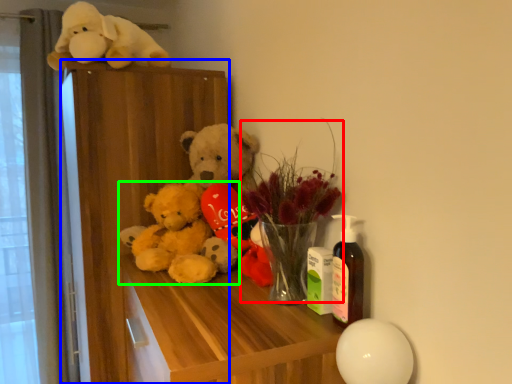
Question: Which is farther away from floral arrangement (highlighted by a red box)? dresser (highlighted by a blue box) or teddy bear (highlighted by a green box)?

Choices:
 (A) dresser
 (B) teddy bear

Answer: (A)